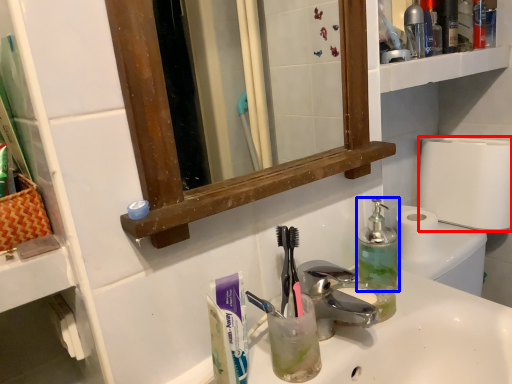
Question: Among these objects, which one is nearest to the camera, toilet roll (highlighted by a red box) or bottle (highlighted by a blue box)?

Choices:
 (A) toilet roll
 (B) bottle

Answer: (B)